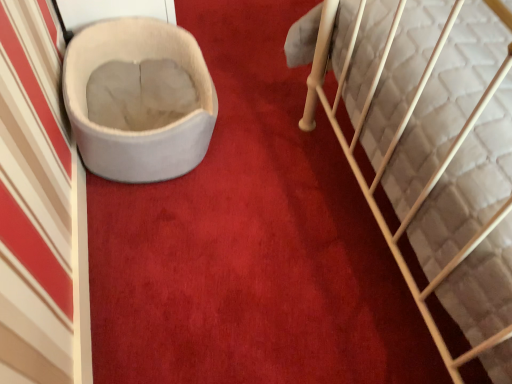
Question: Considering the positions of white plush cat bed at left and soft gray fabric cat bed at left in the image, is white plush cat bed at left taller or shorter than soft gray fabric cat bed at left?

Choices:
 (A) short
 (B) tall

Answer: (B)

Question: Considering their positions, is white plush cat bed at left located in front of or behind soft gray fabric cat bed at left?

Choices:
 (A) front
 (B) behind

Answer: (B)

Question: Is white plush cat bed at left wider or thinner than soft gray fabric cat bed at left?

Choices:
 (A) wide
 (B) thin

Answer: (B)

Question: From a real-world perspective, is soft gray fabric cat bed at left positioned above or below white plush cat bed at left?

Choices:
 (A) above
 (B) below

Answer: (B)

Question: Do you think soft gray fabric cat bed at left is within white plush cat bed at left, or outside of it?

Choices:
 (A) outside
 (B) inside

Answer: (A)

Question: Considering the positions of soft gray fabric cat bed at left and white plush cat bed at left in the image, is soft gray fabric cat bed at left bigger or smaller than white plush cat bed at left?

Choices:
 (A) small
 (B) big

Answer: (B)

Question: Considering the positions of soft gray fabric cat bed at left and white plush cat bed at left in the image, is soft gray fabric cat bed at left wider or thinner than white plush cat bed at left?

Choices:
 (A) wide
 (B) thin

Answer: (A)